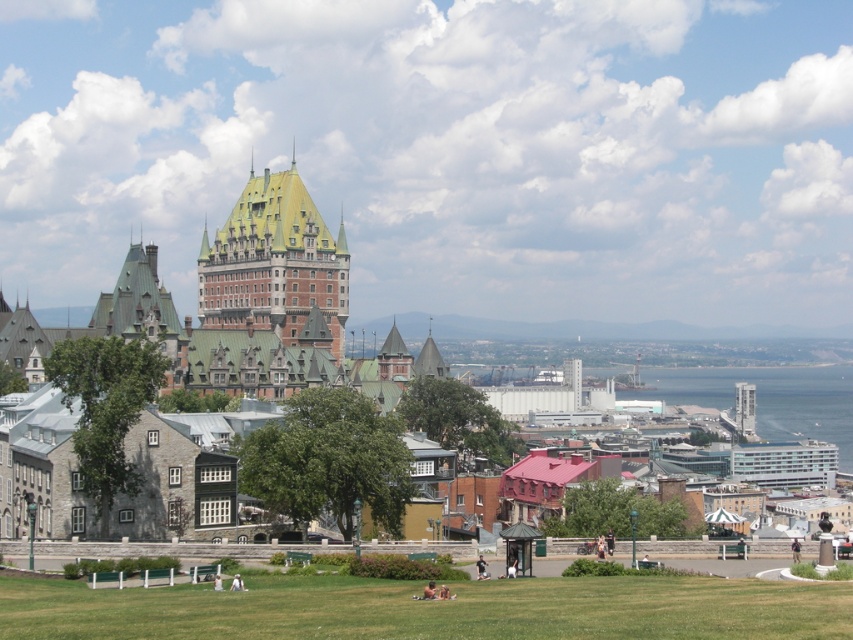
Is green grassy field at lower center wider than stone building at center?

In fact, green grassy field at lower center might be narrower than stone building at center.

Can you confirm if green grassy field at lower center is positioned to the right of stone building at center?

Correct, you'll find green grassy field at lower center to the right of stone building at center.

Describe the element at coordinates (428, 609) in the screenshot. The image size is (853, 640). I see `green grassy field at lower center` at that location.

The height and width of the screenshot is (640, 853). Find the location of `green grassy field at lower center`. green grassy field at lower center is located at coordinates (428, 609).

Looking at this image, who is lower down, stone building at center or blue glass water at lower right?

blue glass water at lower right is lower down.

The image size is (853, 640). I want to click on stone building at center, so click(230, 301).

Does green grassy field at lower center appear on the left side of gold shingles at center?

No, green grassy field at lower center is not to the left of gold shingles at center.

Between green grassy field at lower center and gold shingles at center, which one is positioned lower?

green grassy field at lower center is below.

Is point (221, 611) farther from camera compared to point (296, 198)?

No, it is not.

Find the location of `green grassy field at lower center`. green grassy field at lower center is located at coordinates (428, 609).